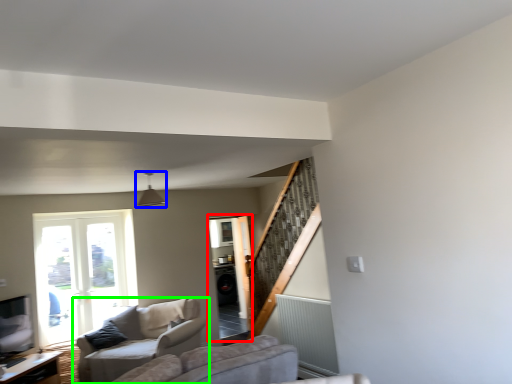
Question: Estimate the real-world distances between objects in this image. Which object is farther from screen door (highlighted by a red box), light fixture (highlighted by a blue box) or studio couch (highlighted by a green box)?

Choices:
 (A) light fixture
 (B) studio couch

Answer: (A)